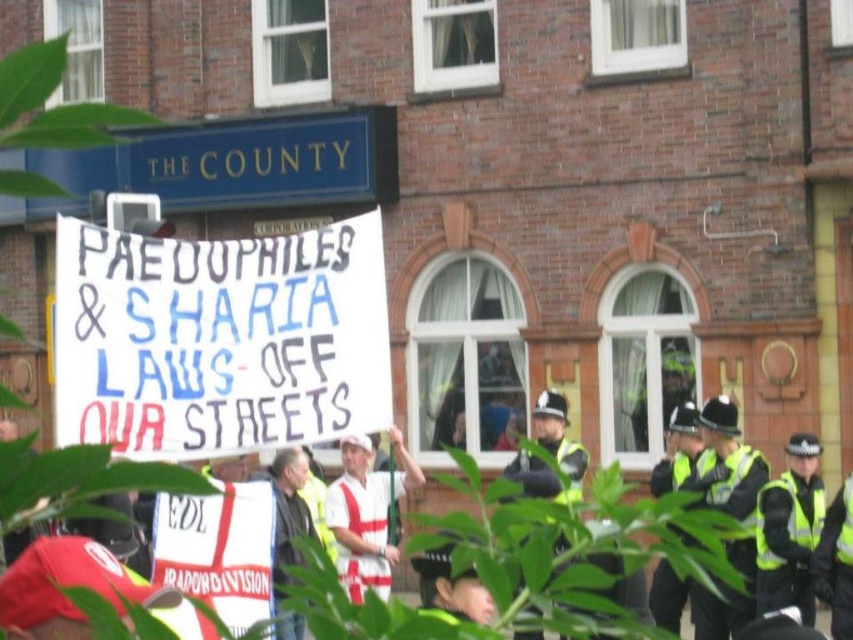
You are a photographer trying to capture a clear shot of both the white fabric shirt at center and the dark gray jacket at center. Since you want to ensure both are visible in the frame, which one should you focus on first to account for their sizes?

The white fabric shirt at center is taller than the dark gray jacket at center, so you should focus on the white fabric shirt at center first to ensure its full height is captured before adjusting for the smaller dark gray jacket at center.

You are a photographer trying to capture the protest scene. You notice two points marked in the image at coordinates point (x=346, y=496) and point (x=289, y=488). Which point is closer to the camera?

Point (x=289, y=488) is closer to the camera because point (x=346, y=496) is behind it.